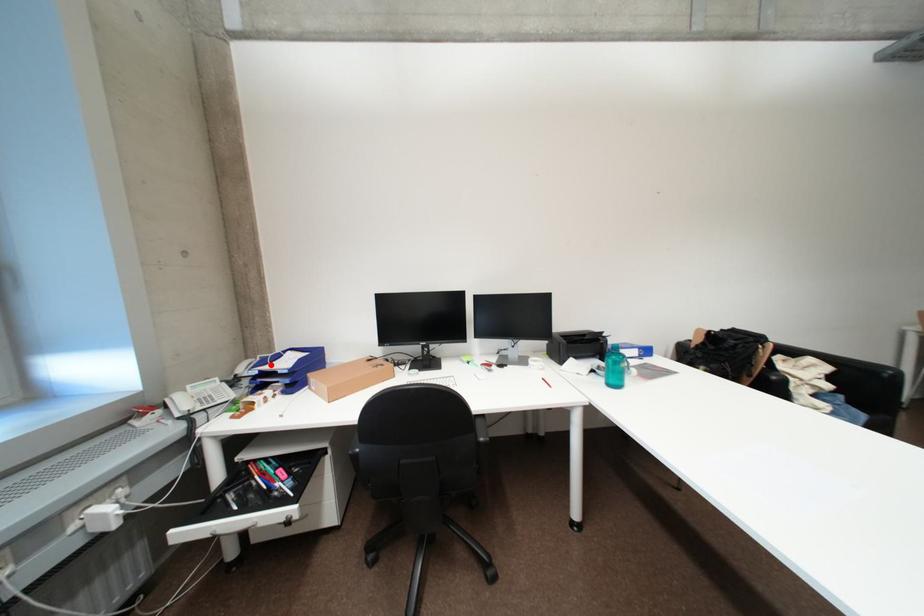
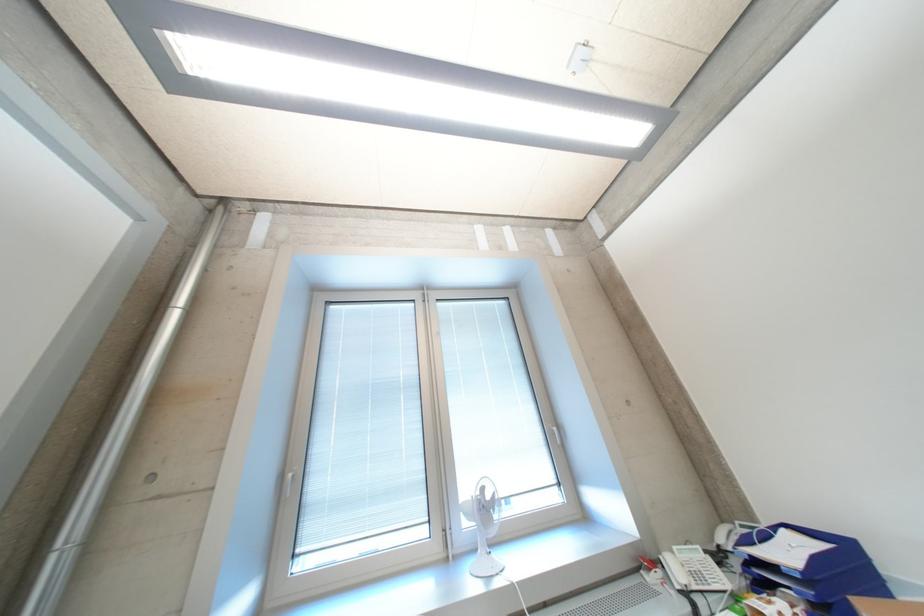
Question: I am providing you with two images of the same scene from different viewpoints. Given a red point in image1, look at the same physical point in image2. Is it:

Choices:
 (A) Closer to the viewpoint
 (B) Farther from the viewpoint

Answer: (A)